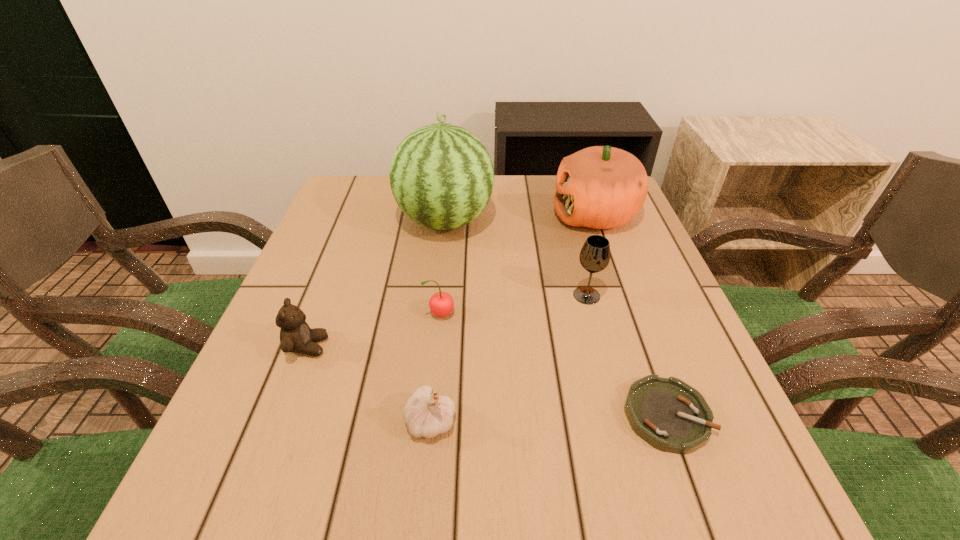
Where is `watermelon`? watermelon is located at coordinates (441, 175).

Where is `the sixth shortest object`? the sixth shortest object is located at coordinates (601, 187).

Identify the location of the third farthest object. (594, 257).

Locate an element on the screen. This screenshot has height=540, width=960. wineglass is located at coordinates (594, 257).

Where is `teddy bear`? teddy bear is located at coordinates (296, 336).

The image size is (960, 540). In order to click on the fifth farthest object in this screenshot , I will do [x=296, y=336].

In order to click on cherry in this screenshot , I will do `click(441, 304)`.

Locate an element on the screen. This screenshot has width=960, height=540. garlic is located at coordinates (425, 415).

Where is `ashtray`? Image resolution: width=960 pixels, height=540 pixels. ashtray is located at coordinates (670, 415).

At what (x,y) coordinates should I click in order to perform the action: click on free point located on the right of the tallest object. Please return your answer as a coordinate pair (x, y). Looking at the image, I should click on (521, 221).